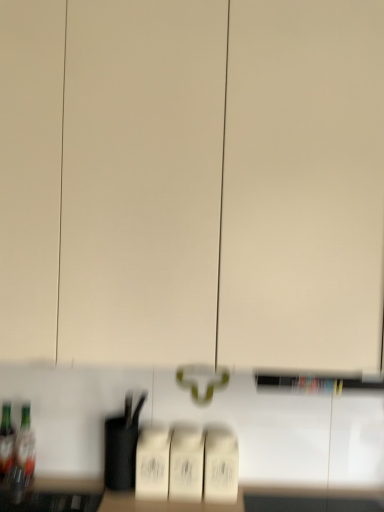
Locate an element on the screen. The image size is (384, 512). translucent glass bottle at lower left, acting as the 1th bottle starting from the left is located at coordinates (6, 441).

This screenshot has height=512, width=384. What do you see at coordinates (6, 441) in the screenshot?
I see `translucent glass bottle at lower left, acting as the 1th bottle starting from the left` at bounding box center [6, 441].

Identify the location of translucent glass bottle at lower left, the second bottle when ordered from left to right. (26, 446).

How much space does translucent glass bottle at lower left, the second bottle when ordered from left to right, occupy vertically?

The height of translucent glass bottle at lower left, the second bottle when ordered from left to right, is 9.88 inches.

The height and width of the screenshot is (512, 384). Describe the element at coordinates (26, 446) in the screenshot. I see `translucent glass bottle at lower left, which ranks as the 1th bottle in right-to-left order` at that location.

The image size is (384, 512). In order to click on translucent glass bottle at lower left, acting as the 1th bottle starting from the left in this screenshot , I will do `click(6, 441)`.

Which is more to the left, translucent glass bottle at lower left, the 2th bottle when ordered from right to left, or translucent glass bottle at lower left, which ranks as the 1th bottle in right-to-left order?

From the viewer's perspective, translucent glass bottle at lower left, the 2th bottle when ordered from right to left, appears more on the left side.

Is translucent glass bottle at lower left, acting as the 1th bottle starting from the left, closer to the viewer compared to translucent glass bottle at lower left, the second bottle when ordered from left to right?

No, it is behind translucent glass bottle at lower left, the second bottle when ordered from left to right.

Does point (8, 439) come behind point (31, 431)?

No, (8, 439) is closer to viewer.

From the image's perspective, relative to translucent glass bottle at lower left, the second bottle when ordered from left to right, is translucent glass bottle at lower left, the 2th bottle when ordered from right to left, above or below?

translucent glass bottle at lower left, the 2th bottle when ordered from right to left, is situated higher than translucent glass bottle at lower left, the second bottle when ordered from left to right, in the image.

From a real-world perspective, is translucent glass bottle at lower left, the 2th bottle when ordered from right to left, positioned above or below translucent glass bottle at lower left, which ranks as the 1th bottle in right-to-left order?

Clearly, from a real-world perspective, translucent glass bottle at lower left, the 2th bottle when ordered from right to left, is below translucent glass bottle at lower left, which ranks as the 1th bottle in right-to-left order.

Based on the photo, does translucent glass bottle at lower left, acting as the 1th bottle starting from the left, have a lesser width compared to translucent glass bottle at lower left, the second bottle when ordered from left to right?

No.

Considering the sizes of objects translucent glass bottle at lower left, the 2th bottle when ordered from right to left, and translucent glass bottle at lower left, the second bottle when ordered from left to right, in the image provided, who is shorter, translucent glass bottle at lower left, the 2th bottle when ordered from right to left, or translucent glass bottle at lower left, the second bottle when ordered from left to right,?

translucent glass bottle at lower left, the 2th bottle when ordered from right to left.

Between translucent glass bottle at lower left, the 2th bottle when ordered from right to left, and translucent glass bottle at lower left, the second bottle when ordered from left to right, which one has larger size?

translucent glass bottle at lower left, the second bottle when ordered from left to right, is bigger.

Could translucent glass bottle at lower left, the second bottle when ordered from left to right, be considered to be inside translucent glass bottle at lower left, acting as the 1th bottle starting from the left?

That's incorrect, translucent glass bottle at lower left, the second bottle when ordered from left to right, is not inside translucent glass bottle at lower left, acting as the 1th bottle starting from the left.

Is translucent glass bottle at lower left, the 2th bottle when ordered from right to left, not near translucent glass bottle at lower left, which ranks as the 1th bottle in right-to-left order?

That's not correct — translucent glass bottle at lower left, the 2th bottle when ordered from right to left, is a little close to translucent glass bottle at lower left, which ranks as the 1th bottle in right-to-left order.

Is translucent glass bottle at lower left, the second bottle when ordered from left to right, at the back of translucent glass bottle at lower left, the 2th bottle when ordered from right to left?

No.

How many degrees apart are the facing directions of translucent glass bottle at lower left, the 2th bottle when ordered from right to left, and translucent glass bottle at lower left, which ranks as the 1th bottle in right-to-left order?

They differ by 0.000107 degrees in their facing directions.

Where is `bottle lying on the left of translucent glass bottle at lower left, which ranks as the 1th bottle in right-to-left order`? This screenshot has width=384, height=512. bottle lying on the left of translucent glass bottle at lower left, which ranks as the 1th bottle in right-to-left order is located at coordinates (6, 441).

Based on their positions, is translucent glass bottle at lower left, the second bottle when ordered from left to right, located to the left or right of translucent glass bottle at lower left, the 2th bottle when ordered from right to left?

Based on their positions, translucent glass bottle at lower left, the second bottle when ordered from left to right, is located to the right of translucent glass bottle at lower left, the 2th bottle when ordered from right to left.

Is translucent glass bottle at lower left, which ranks as the 1th bottle in right-to-left order, further to camera compared to translucent glass bottle at lower left, the 2th bottle when ordered from right to left?

That is False.

Which is closer, (23, 447) or (13, 454)?

Point (23, 447) appears to be farther away from the viewer than point (13, 454).

From the image's perspective, is translucent glass bottle at lower left, the second bottle when ordered from left to right, located beneath translucent glass bottle at lower left, acting as the 1th bottle starting from the left?

Indeed, from the image's perspective, translucent glass bottle at lower left, the second bottle when ordered from left to right, is shown beneath translucent glass bottle at lower left, acting as the 1th bottle starting from the left.

From a real-world perspective, relative to translucent glass bottle at lower left, the 2th bottle when ordered from right to left, is translucent glass bottle at lower left, the second bottle when ordered from left to right, vertically above or below?

translucent glass bottle at lower left, the second bottle when ordered from left to right, is situated higher than translucent glass bottle at lower left, the 2th bottle when ordered from right to left, in the real world.

Is translucent glass bottle at lower left, the second bottle when ordered from left to right, wider than translucent glass bottle at lower left, acting as the 1th bottle starting from the left?

No, translucent glass bottle at lower left, the second bottle when ordered from left to right, is not wider than translucent glass bottle at lower left, acting as the 1th bottle starting from the left.

Between translucent glass bottle at lower left, which ranks as the 1th bottle in right-to-left order, and translucent glass bottle at lower left, the 2th bottle when ordered from right to left, which one has more height?

With more height is translucent glass bottle at lower left, which ranks as the 1th bottle in right-to-left order.

Considering the relative sizes of translucent glass bottle at lower left, which ranks as the 1th bottle in right-to-left order, and translucent glass bottle at lower left, the 2th bottle when ordered from right to left, in the image provided, is translucent glass bottle at lower left, which ranks as the 1th bottle in right-to-left order, bigger than translucent glass bottle at lower left, the 2th bottle when ordered from right to left,?

Yes, translucent glass bottle at lower left, which ranks as the 1th bottle in right-to-left order, is bigger than translucent glass bottle at lower left, the 2th bottle when ordered from right to left.

Would you say translucent glass bottle at lower left, the second bottle when ordered from left to right, is inside or outside translucent glass bottle at lower left, acting as the 1th bottle starting from the left?

translucent glass bottle at lower left, the second bottle when ordered from left to right, is outside translucent glass bottle at lower left, acting as the 1th bottle starting from the left.

From the picture: Is translucent glass bottle at lower left, which ranks as the 1th bottle in right-to-left order, not close to translucent glass bottle at lower left, the 2th bottle when ordered from right to left?

That's not correct — translucent glass bottle at lower left, which ranks as the 1th bottle in right-to-left order, is a little close to translucent glass bottle at lower left, the 2th bottle when ordered from right to left.

Is translucent glass bottle at lower left, the second bottle when ordered from left to right, facing towards translucent glass bottle at lower left, acting as the 1th bottle starting from the left?

No, translucent glass bottle at lower left, the second bottle when ordered from left to right, is not oriented towards translucent glass bottle at lower left, acting as the 1th bottle starting from the left.

How different are the orientations of translucent glass bottle at lower left, which ranks as the 1th bottle in right-to-left order, and translucent glass bottle at lower left, acting as the 1th bottle starting from the left, in degrees?

0.000107 degrees separate the facing orientations of translucent glass bottle at lower left, which ranks as the 1th bottle in right-to-left order, and translucent glass bottle at lower left, acting as the 1th bottle starting from the left.

Could you measure the distance between translucent glass bottle at lower left, which ranks as the 1th bottle in right-to-left order, and translucent glass bottle at lower left, the 2th bottle when ordered from right to left?

A distance of 1.65 inches exists between translucent glass bottle at lower left, which ranks as the 1th bottle in right-to-left order, and translucent glass bottle at lower left, the 2th bottle when ordered from right to left.

What are the coordinates of `bottle on the right of the translucent glass bottle at lower left, the 2th bottle when ordered from right to left` in the screenshot? It's located at (26, 446).

The width and height of the screenshot is (384, 512). I want to click on bottle behind the translucent glass bottle at lower left, which ranks as the 1th bottle in right-to-left order, so click(6, 441).

Identify the location of bottle below the translucent glass bottle at lower left, the 2th bottle when ordered from right to left (from the image's perspective). (26, 446).